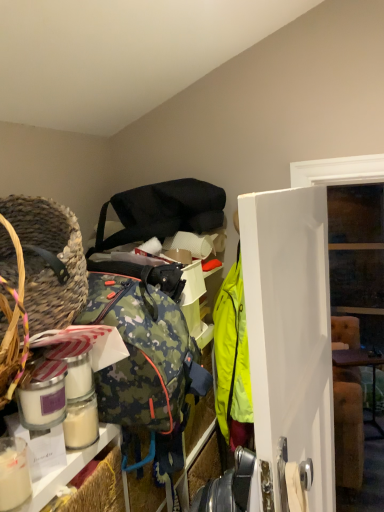
Question: Can you confirm if brown wooden table at right is shorter than braided straw basket at left?

Choices:
 (A) yes
 (B) no

Answer: (B)

Question: From the image's perspective, is brown wooden table at right beneath braided straw basket at left?

Choices:
 (A) no
 (B) yes

Answer: (B)

Question: From a real-world perspective, is brown wooden table at right located higher than braided straw basket at left?

Choices:
 (A) no
 (B) yes

Answer: (A)

Question: From the image's perspective, is brown wooden table at right on top of braided straw basket at left?

Choices:
 (A) no
 (B) yes

Answer: (A)

Question: Does brown wooden table at right appear on the right side of braided straw basket at left?

Choices:
 (A) yes
 (B) no

Answer: (A)

Question: Considering the relative positions of white glossy door at center and matte black shoulder bag at upper center in the image provided, is white glossy door at center to the left or to the right of matte black shoulder bag at upper center?

Choices:
 (A) right
 (B) left

Answer: (A)

Question: From the image's perspective, relative to matte black shoulder bag at upper center, is white glossy door at center above or below?

Choices:
 (A) above
 (B) below

Answer: (B)

Question: Does point pyautogui.click(x=294, y=367) appear closer or farther from the camera than point pyautogui.click(x=198, y=211)?

Choices:
 (A) farther
 (B) closer

Answer: (B)

Question: Based on their sizes in the image, would you say white glossy door at center is bigger or smaller than matte black shoulder bag at upper center?

Choices:
 (A) small
 (B) big

Answer: (B)

Question: Considering the positions of brown wooden table at right and white glossy door at center in the image, is brown wooden table at right taller or shorter than white glossy door at center?

Choices:
 (A) tall
 (B) short

Answer: (B)

Question: From the image's perspective, is brown wooden table at right above or below white glossy door at center?

Choices:
 (A) above
 (B) below

Answer: (B)

Question: Is brown wooden table at right wider or thinner than white glossy door at center?

Choices:
 (A) wide
 (B) thin

Answer: (A)

Question: Based on their positions, is brown wooden table at right located to the left or right of white glossy door at center?

Choices:
 (A) right
 (B) left

Answer: (A)

Question: Is braided straw basket at left wider or thinner than white glossy door at center?

Choices:
 (A) thin
 (B) wide

Answer: (B)

Question: Is point (74, 280) closer or farther from the camera than point (312, 423)?

Choices:
 (A) closer
 (B) farther

Answer: (A)